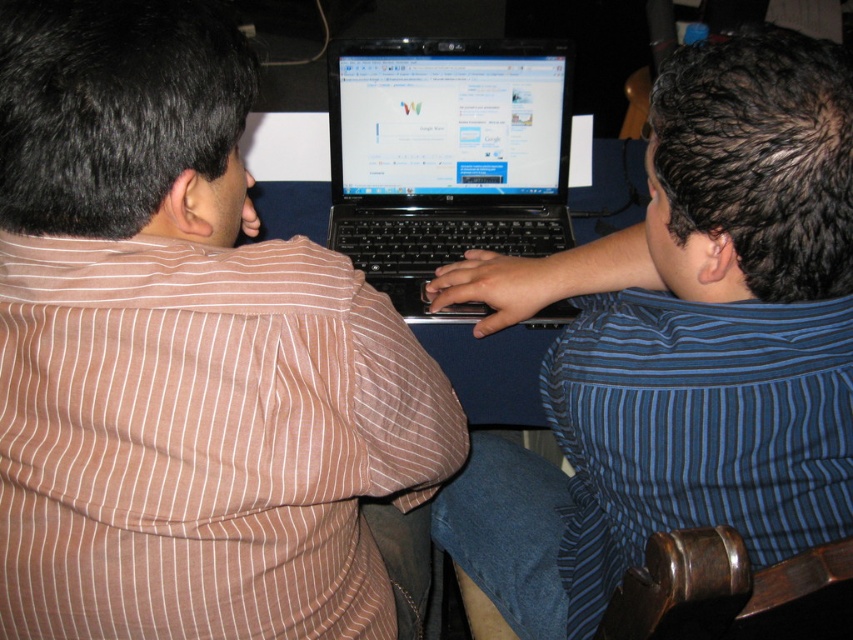
Can you confirm if brown striped shirt at left is positioned below blue striped shirt at center?

Indeed, brown striped shirt at left is positioned under blue striped shirt at center.

Who is more distant from viewer, (15, 440) or (540, 481)?

Positioned behind is point (540, 481).

Identify the location of brown striped shirt at left. (189, 362).

You are a GUI agent. You are given a task and a screenshot of the screen. Output one action in this format:
    pyautogui.click(x=<x>, y=<y>)
    Task: Click on the brown striped shirt at left
    Image resolution: width=853 pixels, height=640 pixels.
    Given the screenshot: What is the action you would take?
    coord(189,362)

Who is positioned more to the right, brown striped shirt at left or black plastic laptop at center?

Positioned to the right is black plastic laptop at center.

Identify the location of brown striped shirt at left. (189, 362).

Find the location of a particular element. The height and width of the screenshot is (640, 853). brown striped shirt at left is located at coordinates (189, 362).

Between point (495, 563) and point (410, 243), which one is positioned behind?

Positioned behind is point (410, 243).

Is the position of blue striped shirt at center more distant than that of black plastic laptop at center?

That is False.

Which is behind, point (578, 589) or point (408, 60)?

Point (408, 60)

At what (x,y) coordinates should I click in order to perform the action: click on blue striped shirt at center. Please return your answer as a coordinate pair (x, y). Looking at the image, I should click on (680, 346).